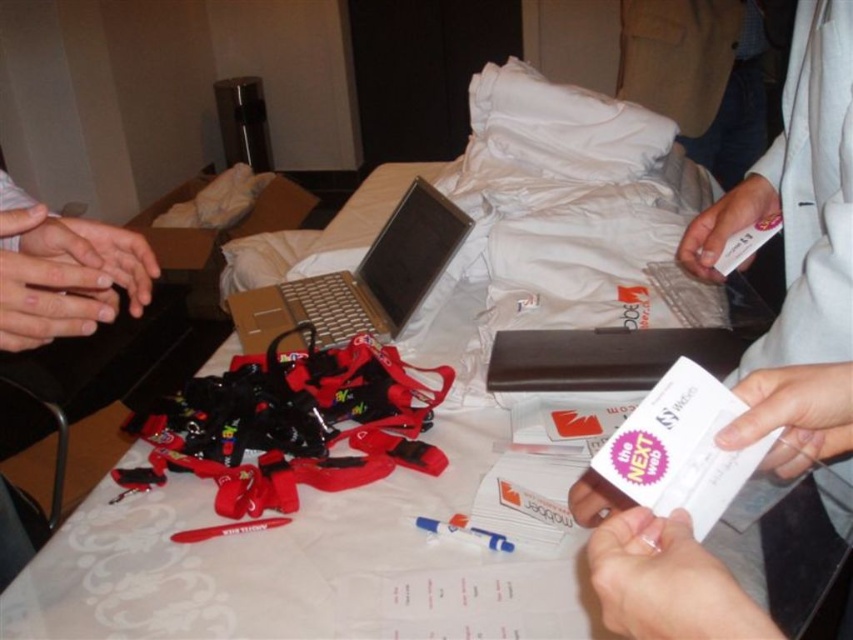
You are organizing the event materials and need to place the silver metallic laptop at center in a specific location. According to the coordinates provided, where exactly is the laptop positioned on the table?

The silver metallic laptop at center is located at point coordinates of (358, 282).

You are setting up for an event and need to place a name tag on the silver metallic laptop at center so that it is visible from above. Considering the size of the matte black hands at center, will the name tag fit without overlapping the edges?

The silver metallic laptop at center is taller than the matte black hands at center. Since the laptop is taller, the name tag can be placed on the laptop without overlapping the edges as the laptop provides enough space vertically compared to the hands.

You are at the registration desk and need to hand over a form to the person in front of you. The form is located at point (347, 333). However, there is an obstacle at point (90, 285). Can you reach the form without moving around the obstacle?

Point (347, 333) is behind point (90, 285), so you cannot reach the form without moving around the obstacle.